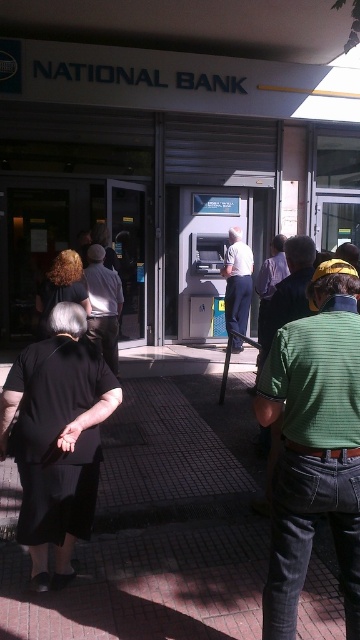
Question: Which of the following is the farthest from the observer?

Choices:
 (A) dark gray pants at center
 (B) brick pavement at center
 (C) white matte shirt at center

Answer: (C)

Question: Is metal atm at center positioned in front of green striped shirt at center?

Choices:
 (A) no
 (B) yes

Answer: (A)

Question: Estimate the real-world distances between objects in this image. Which object is closer to the white matte shirt at center?

Choices:
 (A) green striped shirt at center
 (B) brick pavement at center

Answer: (B)

Question: Which of the following is the farthest from the observer?

Choices:
 (A) (333, 276)
 (B) (191, 636)
 (C) (248, 314)

Answer: (C)

Question: Is brick pavement at center smaller than white matte shirt at center?

Choices:
 (A) yes
 (B) no

Answer: (B)

Question: Is brick pavement at center smaller than white matte shirt at center?

Choices:
 (A) yes
 (B) no

Answer: (B)